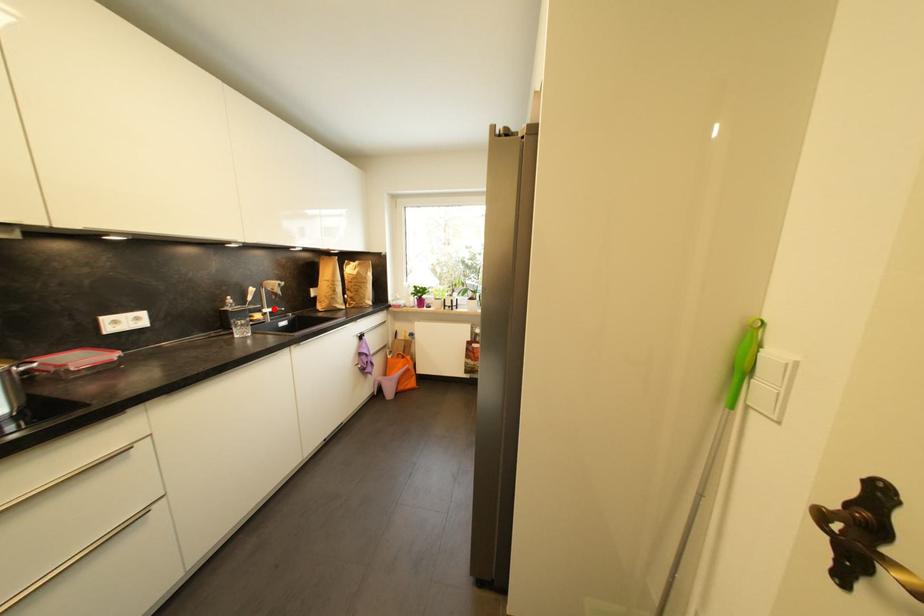
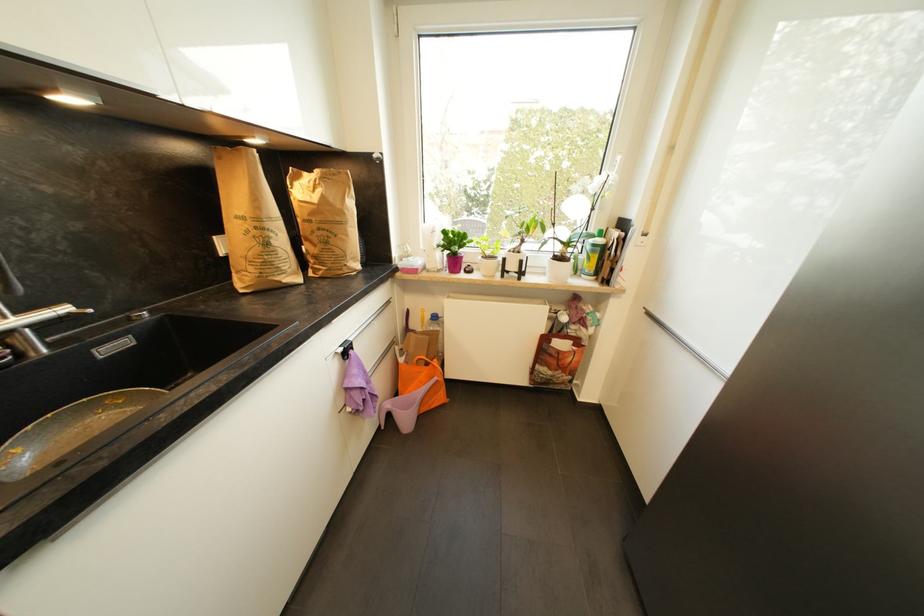
Question: I am providing you with two images of the same scene from different viewpoints. Given a red point in image1, look at the same physical point in image2. Is it:

Choices:
 (A) Closer to the viewpoint
 (B) Farther from the viewpoint

Answer: (B)